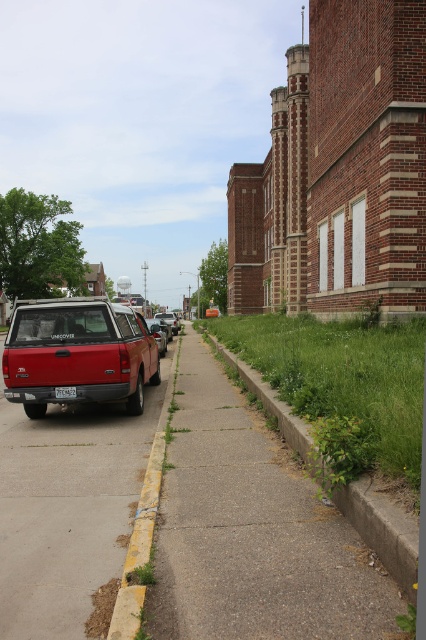
Looking at this image, does concrete sidewalk at lower left appear on the right side of yellow concrete curb at lower left?

In fact, concrete sidewalk at lower left is to the left of yellow concrete curb at lower left.

Which is behind, point (108, 522) or point (129, 547)?

Positioned behind is point (108, 522).

Describe the element at coordinates (68, 509) in the screenshot. I see `concrete sidewalk at lower left` at that location.

Identify the location of concrete sidewalk at lower left. (68, 509).

Is point (144, 477) closer to viewer compared to point (173, 321)?

Yes, point (144, 477) is in front of point (173, 321).

Between yellow concrete curb at lower left and metallic silver sedan at center, which one is positioned lower?

yellow concrete curb at lower left is below.

Does point (134, 582) come farther from viewer compared to point (164, 316)?

No, it is not.

Find the location of a particular element. yellow concrete curb at lower left is located at coordinates [143, 525].

Is matte red truck at left in front of black metal license plate at center?

No, it is not.

Can you confirm if matte red truck at left is positioned to the right of black metal license plate at center?

Correct, you'll find matte red truck at left to the right of black metal license plate at center.

Who is more distant from viewer, (60,308) or (58,397)?

The point (60,308) is more distant.

Image resolution: width=426 pixels, height=640 pixels. I want to click on matte red truck at left, so click(x=77, y=353).